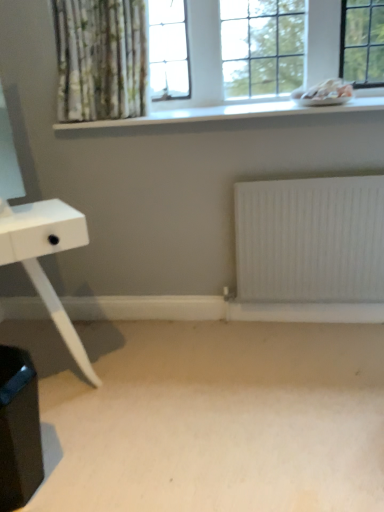
Locate an element on the screen. The height and width of the screenshot is (512, 384). beige carpet at lower center is located at coordinates tap(210, 416).

Image resolution: width=384 pixels, height=512 pixels. What do you see at coordinates (210, 416) in the screenshot?
I see `beige carpet at lower center` at bounding box center [210, 416].

The width and height of the screenshot is (384, 512). Identify the location of white matte radiator at lower center. (310, 240).

Is beige carpet at lower center far from white smooth window sill at upper center?

Absolutely, beige carpet at lower center is distant from white smooth window sill at upper center.

Measure the distance between beige carpet at lower center and white smooth window sill at upper center.

beige carpet at lower center and white smooth window sill at upper center are 3.88 feet apart from each other.

Is beige carpet at lower center not within white smooth window sill at upper center?

beige carpet at lower center lies outside white smooth window sill at upper center's area.

Is point (382, 93) closer or farther from the camera than point (28, 261)?

Point (382, 93).

How different are the orientations of white glass window at upper center and white matte table at left in degrees?

36.2 degrees separate the facing orientations of white glass window at upper center and white matte table at left.

How distant is white glass window at upper center from white matte table at left?

89.83 centimeters.

Which object is wider, white glass window at upper center or white matte table at left?

Wider between the two is white matte table at left.

Locate an element on the screen. plain located below the white glass window at upper center (from the image's perspective) is located at coordinates (210, 416).

How many degrees apart are the facing directions of white glass window at upper center and beige carpet at lower center?

0.338 degrees.

From a real-world perspective, is white glass window at upper center located beneath beige carpet at lower center?

No.

Is white glass window at upper center oriented towards beige carpet at lower center?

No.

Is white matte radiator at lower center wider or thinner than beige carpet at lower center?

white matte radiator at lower center is thinner than beige carpet at lower center.

At what (x,y) coordinates should I click in order to perform the action: click on plain on the left of white matte radiator at lower center. Please return your answer as a coordinate pair (x, y). Looking at the image, I should click on (210, 416).

Considering the points (311, 263) and (286, 439), which point is behind, point (311, 263) or point (286, 439)?

Point (311, 263)

From the picture: Is white matte radiator at lower center turned away from beige carpet at lower center?

No, white matte radiator at lower center's orientation is not away from beige carpet at lower center.

Based on the photo, is white glass window at upper center facing towards white matte radiator at lower center?

No, white glass window at upper center is not aimed at white matte radiator at lower center.

Are white glass window at upper center and white matte radiator at lower center far apart?

No, there isn't a large distance between white glass window at upper center and white matte radiator at lower center.

Which is more distant, (170, 119) or (247, 211)?

The point (247, 211) is more distant.

This screenshot has width=384, height=512. Find the location of `radiator below the white glass window at upper center (from the image's perspective)`. radiator below the white glass window at upper center (from the image's perspective) is located at coordinates (310, 240).

Based on the photo, is white matte radiator at lower center far away from white matte table at left?

white matte radiator at lower center is actually quite close to white matte table at left.

Is white matte radiator at lower center wider than white matte table at left?

No.

Based on the photo, does white matte radiator at lower center come behind white matte table at left?

Yes, white matte radiator at lower center is behind white matte table at left.

Considering the positions of point (252, 213) and point (52, 229), is point (252, 213) closer or farther from the camera than point (52, 229)?

Point (252, 213) appears to be farther away from the viewer than point (52, 229).

Considering the sizes of white matte table at left and beige carpet at lower center in the image, is white matte table at left bigger or smaller than beige carpet at lower center?

white matte table at left is bigger than beige carpet at lower center.

The image size is (384, 512). In order to click on table behind the beige carpet at lower center in this screenshot , I will do `click(44, 255)`.

Which is correct: white matte table at left is inside beige carpet at lower center, or outside of it?

white matte table at left is outside beige carpet at lower center.

Where is `plain below the white smooth window sill at upper center (from the image's perspective)`? The height and width of the screenshot is (512, 384). plain below the white smooth window sill at upper center (from the image's perspective) is located at coordinates (210, 416).

At what (x,y) coordinates should I click in order to perform the action: click on window above the white matte table at left (from the image's perspective). Please return your answer as a coordinate pair (x, y). Looking at the image, I should click on (200, 84).

Looking at the image, which one is located further to beige carpet at lower center, white smooth window sill at upper center or white matte table at left?

white smooth window sill at upper center.

Based on their spatial positions, is white smooth window sill at upper center or white matte table at left further from white glass window at upper center?

The object further to white glass window at upper center is white matte table at left.

Estimate the real-world distances between objects in this image. Which object is further from white matte table at left, white matte radiator at lower center or beige carpet at lower center?

The object further to white matte table at left is white matte radiator at lower center.

Which object lies nearer to the anchor point white matte table at left, beige carpet at lower center or white matte radiator at lower center?

beige carpet at lower center is closer to white matte table at left.

Based on the photo, looking at the image, which one is located further to white smooth window sill at upper center, beige carpet at lower center or white matte table at left?

beige carpet at lower center.

Which object lies nearer to the anchor point white glass window at upper center, beige carpet at lower center or white smooth window sill at upper center?

white smooth window sill at upper center.

Which object lies nearer to the anchor point white matte table at left, white smooth window sill at upper center or white matte radiator at lower center?

The object closer to white matte table at left is white smooth window sill at upper center.

Looking at the image, which one is located further to beige carpet at lower center, white matte table at left or white smooth window sill at upper center?

The object further to beige carpet at lower center is white smooth window sill at upper center.

Identify the location of table between white glass window at upper center and beige carpet at lower center vertically. (44, 255).

Where is `window sill between white glass window at upper center and white matte radiator at lower center in the vertical direction`? The image size is (384, 512). window sill between white glass window at upper center and white matte radiator at lower center in the vertical direction is located at coordinates (230, 113).

Identify the location of plain between white matte table at left and white matte radiator at lower center from left to right. This screenshot has height=512, width=384. (210, 416).

Locate an element on the screen. The height and width of the screenshot is (512, 384). window sill that lies between white glass window at upper center and beige carpet at lower center from top to bottom is located at coordinates (230, 113).